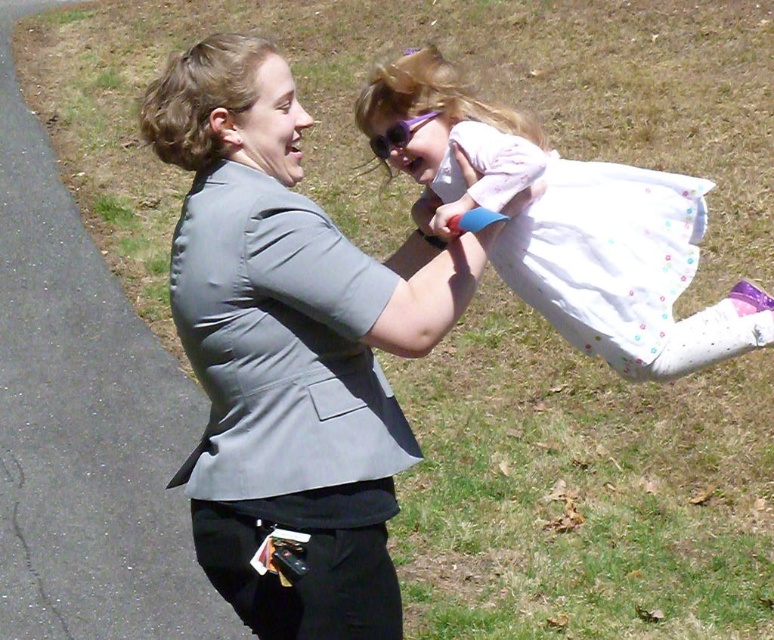
Question: Which point is closer to the camera?

Choices:
 (A) white dotted dress at center
 (B) gray fabric jacket at center
 (C) purple plastic goggles at upper center

Answer: (B)

Question: Is gray fabric jacket at center behind purple plastic goggles at upper center?

Choices:
 (A) no
 (B) yes

Answer: (A)

Question: In this image, where is gray fabric jacket at center located relative to white dotted dress at center?

Choices:
 (A) left
 (B) right

Answer: (A)

Question: Can you confirm if gray fabric jacket at center is positioned to the left of white dotted dress at center?

Choices:
 (A) no
 (B) yes

Answer: (B)

Question: Which object appears farthest from the camera in this image?

Choices:
 (A) white dotted dress at center
 (B) gray fabric jacket at center
 (C) purple plastic goggles at upper center

Answer: (C)

Question: Which point is closer to the camera taking this photo?

Choices:
 (A) (651, 339)
 (B) (399, 129)

Answer: (A)